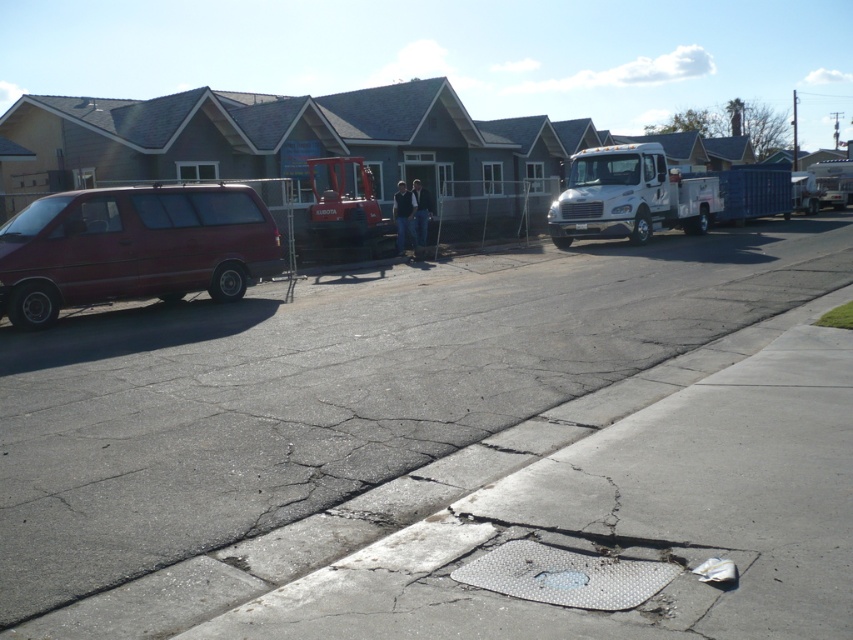
Consider the image. You are standing at the point labeled as point (132,248) on the residential street. Which vehicle are you touching?

You are touching the matte red van at left because the point (132,248) is located on it.

You are a pedestrian standing on the sidewalk and want to cross the street. You see the matte red van at left and the white metallic truck at center. Which vehicle is closer to you?

The matte red van at left is closer to you because it is in front of the white metallic truck at center.